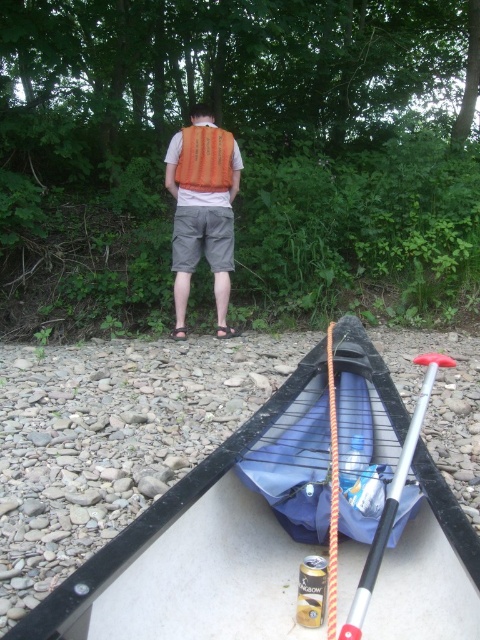
Which of these two, black plastic boat at lower center or silver metallic paddle at lower right, stands taller?

black plastic boat at lower center

In the scene shown: Does black plastic boat at lower center appear on the right side of silver metallic paddle at lower right?

In fact, black plastic boat at lower center is to the left of silver metallic paddle at lower right.

I want to click on black plastic boat at lower center, so [193, 552].

Who is positioned more to the right, orange fabric life vest at center or silver metallic paddle at lower right?

From the viewer's perspective, silver metallic paddle at lower right appears more on the right side.

Is orange fabric life vest at center further to the viewer compared to silver metallic paddle at lower right?

Yes, orange fabric life vest at center is further from the viewer.

This screenshot has width=480, height=640. Identify the location of orange fabric life vest at center. (203, 209).

Does black plastic boat at lower center appear under orange fabric life vest at center?

Yes, black plastic boat at lower center is below orange fabric life vest at center.

Is black plastic boat at lower center shorter than orange fabric life vest at center?

Correct, black plastic boat at lower center is not as tall as orange fabric life vest at center.

At what (x,y) coordinates should I click in order to perform the action: click on black plastic boat at lower center. Please return your answer as a coordinate pair (x, y). Looking at the image, I should click on (193, 552).